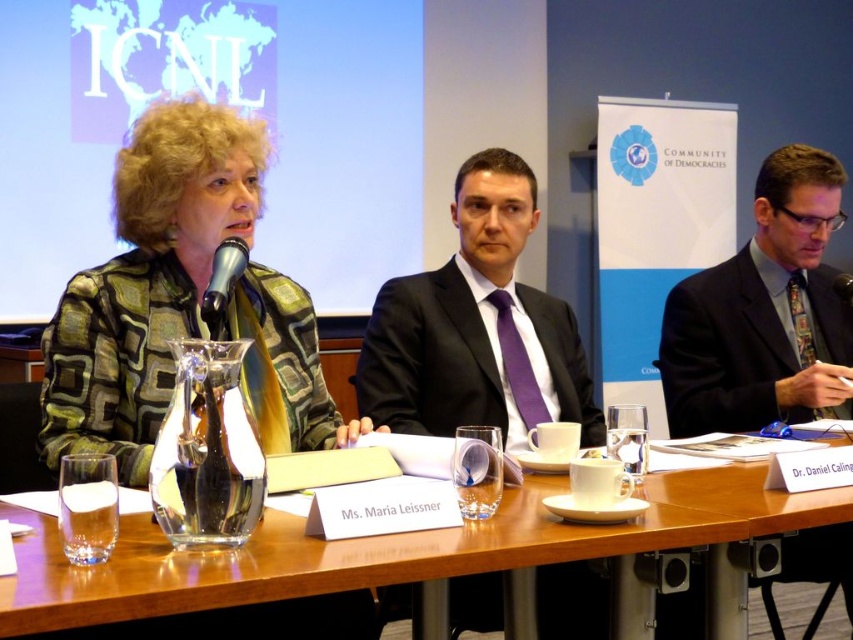
Does black satin suit at center appear on the left side of dark blue suit at right?

Correct, you'll find black satin suit at center to the left of dark blue suit at right.

Locate an element on the screen. black satin suit at center is located at coordinates (436, 356).

Where is `black satin suit at center`? Image resolution: width=853 pixels, height=640 pixels. black satin suit at center is located at coordinates (436, 356).

Is wooden table at center to the right of metallic silver microphone at center from the viewer's perspective?

No, wooden table at center is not to the right of metallic silver microphone at center.

Between wooden table at center and metallic silver microphone at center, which one appears on the right side from the viewer's perspective?

metallic silver microphone at center

Is point (270, 568) farther from camera compared to point (834, 282)?

No, it is in front of (834, 282).

Find the location of a particular element. This screenshot has height=640, width=853. wooden table at center is located at coordinates (410, 554).

How much distance is there between wooden table at center and dark blue suit at right?

A distance of 33.31 inches exists between wooden table at center and dark blue suit at right.

Does wooden table at center have a smaller size compared to dark blue suit at right?

No, wooden table at center is not smaller than dark blue suit at right.

From the picture: Who is more forward, (x=706, y=516) or (x=705, y=404)?

Point (x=706, y=516) is more forward.

Image resolution: width=853 pixels, height=640 pixels. Identify the location of wooden table at center. (410, 554).